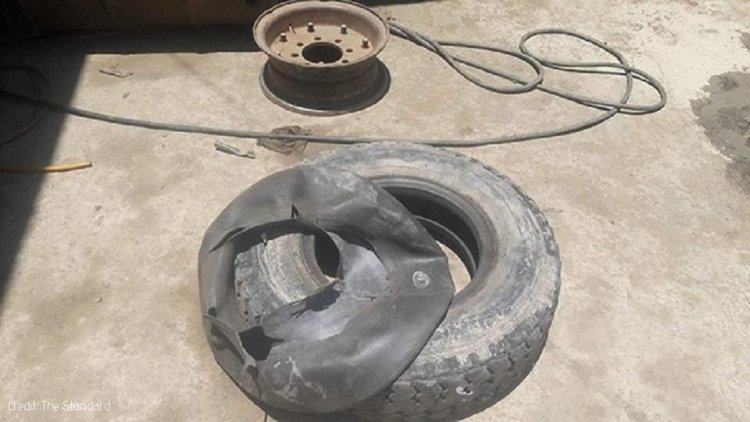
The width and height of the screenshot is (750, 422). In order to click on cable in this screenshot , I will do `click(530, 132)`.